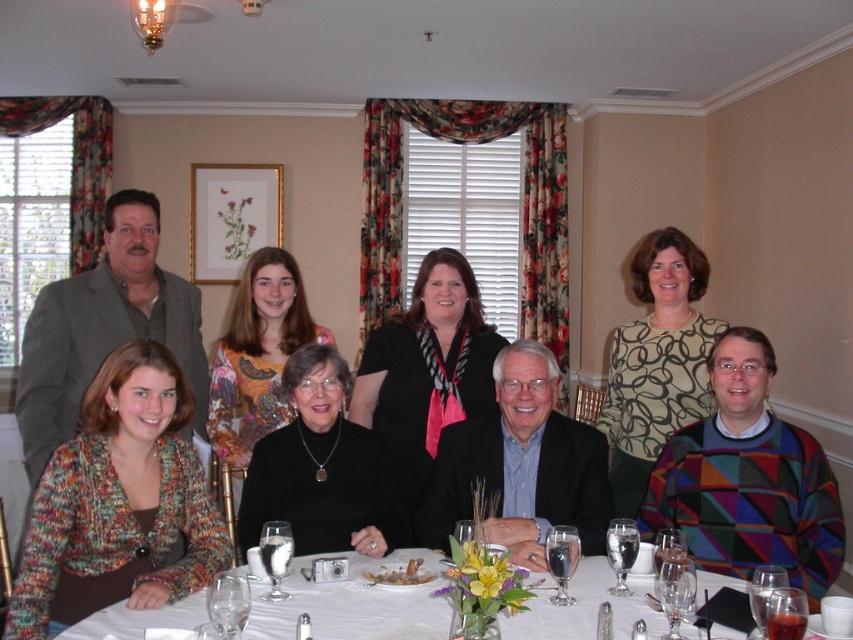
You are a photographer at a formal event and need to adjust the camera focus to capture both the black sweater at center and the printed fabric blouse at center. Which clothing item will require focusing on a lower area due to its shorter height?

The black sweater at center is shorter than the printed fabric blouse at center, so the photographer should focus on a lower area for the black sweater at center to capture it properly.

You are a photographer setting up for a group photo. You have two subjects wearing the black sweater at center and the printed fabric blouse at center. Which subject should you position closer to the camera to ensure both appear equally wide in the photo?

You should position the printed fabric blouse at center closer to the camera because the black sweater at center is wider in reality. By moving the narrower printed fabric blouse at center forward, their apparent widths in the photo will balance out.

You are a photographer setting up for a formal dinner. You need to ensure that all clothing items on the table are visible in the photo. The multicolored knitted sweater at lower left and the black satin scarf at center are partially covering some table items. Which clothing item is more likely to be blocking the view of the table items?

The black satin scarf at center occupies more space than the multicolored knitted sweater at lower left, so it is more likely to be blocking the view of the table items.